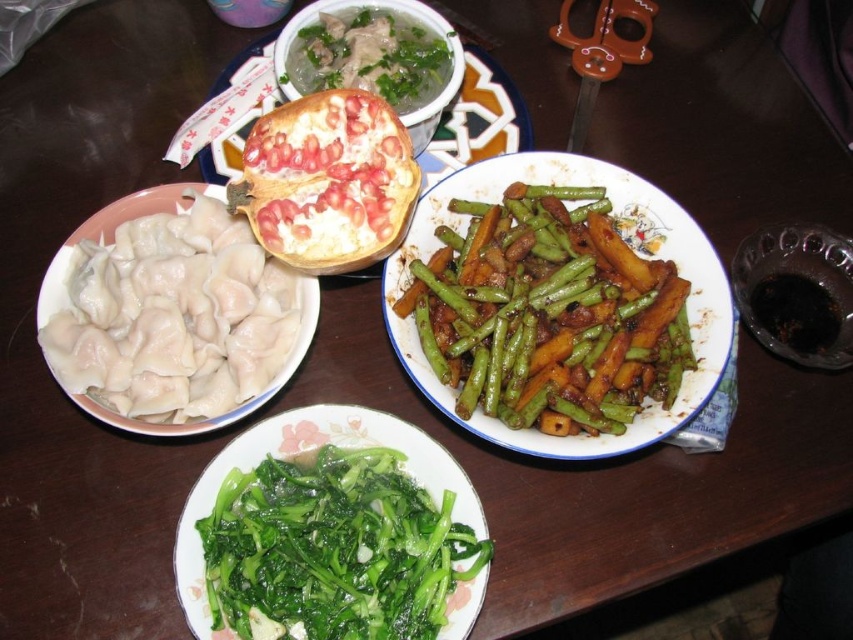
You are a waiter trying to place a new dish on the table. You have two points marked on the table where you can place it. The points are at coordinates point [444,349] and point [271,586]. Which point is closer to you, the waiter, so you can easily reach it?

Point [444,349] is closer to you than point [271,586], so you can easily reach it.

You are a food critic evaluating the arrangement of dishes on a wooden table. You notice the green leafy vegetables at bottom and the pomegranate seeds at center. Which of these two items has a greater height in the image?

The pomegranate seeds at center are taller than the green leafy vegetables at bottom.

You are a chef arranging dishes on a table. You have the green glossy string beans at center right and green leafy vegetables at bottom. Which of these has a greater width?

The green glossy string beans at center right has a greater width than the green leafy vegetables at bottom according to the description provided.